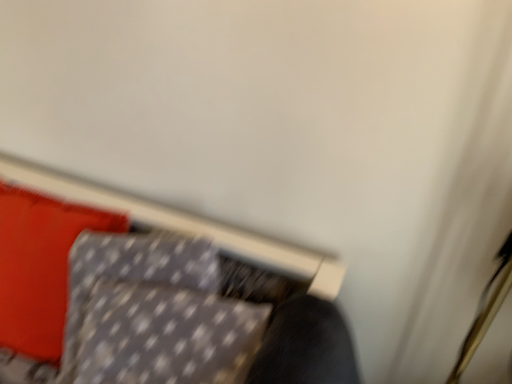
Question: Relative to gray dotted fabric cushion at lower left, is gray dotted pillow at upper left in front or behind?

Choices:
 (A) behind
 (B) front

Answer: (A)

Question: From the image's perspective, is gray dotted pillow at upper left located above or below gray dotted fabric cushion at lower left?

Choices:
 (A) below
 (B) above

Answer: (B)

Question: Is gray dotted pillow at upper left taller or shorter than gray dotted fabric cushion at lower left?

Choices:
 (A) tall
 (B) short

Answer: (A)

Question: In terms of height, does gray dotted fabric cushion at lower left look taller or shorter compared to gray dotted pillow at upper left?

Choices:
 (A) tall
 (B) short

Answer: (B)

Question: Is point (173, 377) closer or farther from the camera than point (104, 231)?

Choices:
 (A) closer
 (B) farther

Answer: (A)

Question: Would you say gray dotted fabric cushion at lower left is inside or outside gray dotted pillow at upper left?

Choices:
 (A) inside
 (B) outside

Answer: (B)

Question: Considering the positions of gray dotted fabric cushion at lower left and gray dotted pillow at upper left in the image, is gray dotted fabric cushion at lower left bigger or smaller than gray dotted pillow at upper left?

Choices:
 (A) small
 (B) big

Answer: (B)